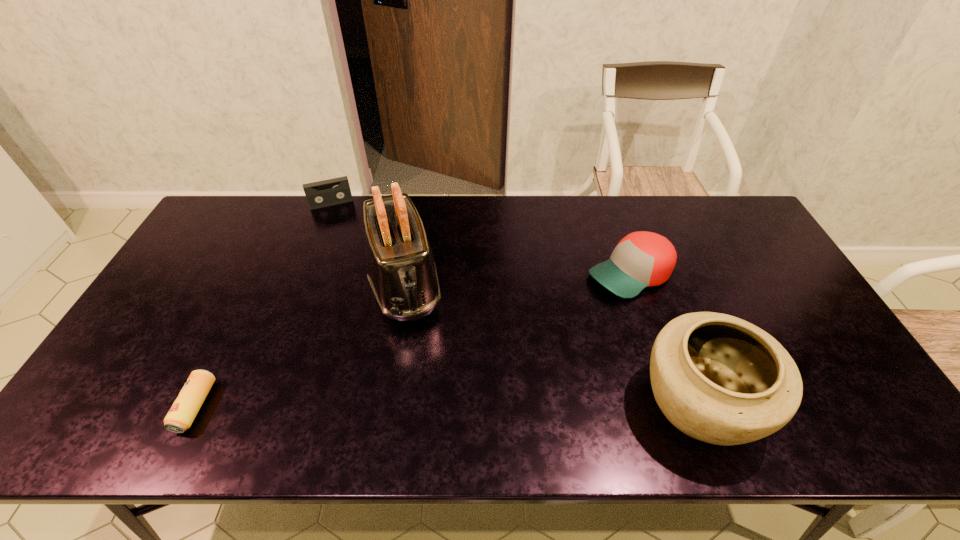
Image resolution: width=960 pixels, height=540 pixels. I want to click on beer can located in the near edge section of the desktop, so click(x=181, y=415).

At what (x,y) coordinates should I click in order to perform the action: click on pottery that is at the near edge. Please return your answer as a coordinate pair (x, y). Image resolution: width=960 pixels, height=540 pixels. Looking at the image, I should click on (717, 378).

In the image, there is a desktop. Identify the location of vacant space at the far edge. The width and height of the screenshot is (960, 540). (528, 220).

Where is `blank space at the near edge of the desktop`? The width and height of the screenshot is (960, 540). blank space at the near edge of the desktop is located at coordinates (260, 392).

Identify the location of free region at the left edge of the desktop. (151, 366).

Where is `vacant space at the near left corner of the desktop`? Image resolution: width=960 pixels, height=540 pixels. vacant space at the near left corner of the desktop is located at coordinates [139, 376].

Where is `free space at the far right corner of the desktop`? The height and width of the screenshot is (540, 960). free space at the far right corner of the desktop is located at coordinates coord(711,224).

This screenshot has width=960, height=540. I want to click on free space between the tallest object and the beer can, so click(300, 345).

You are a GUI agent. You are given a task and a screenshot of the screen. Output one action in this format:
    pyautogui.click(x=<x>, y=<y>)
    Task: Click on the free space that is in between the tallest object and the baseball cap
    The image size is (960, 540).
    Given the screenshot: What is the action you would take?
    pyautogui.click(x=517, y=279)

Locate an element on the screen. This screenshot has height=540, width=960. vacant area between the videotape and the pottery is located at coordinates (516, 303).